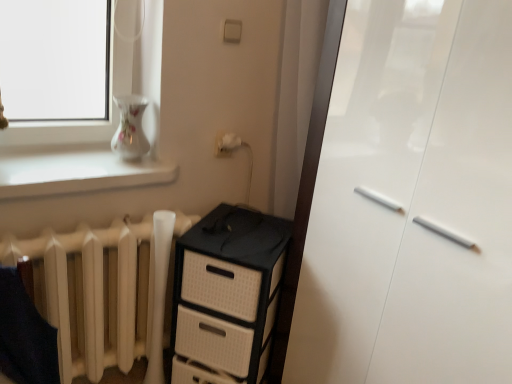
Find the location of a particular element. free space above black plastic chest of drawers at center (from a real-world perspective) is located at coordinates (240, 227).